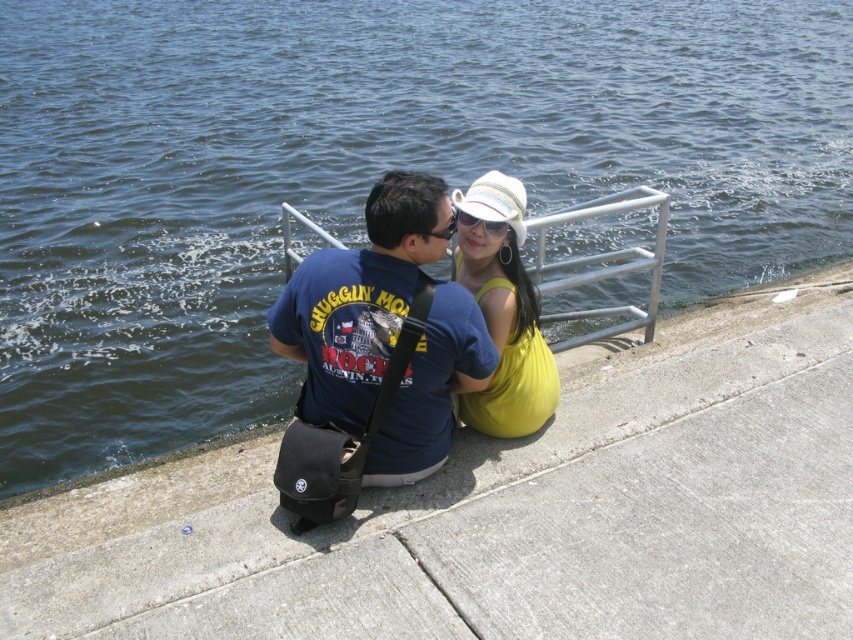
Does blue cotton t-shirt at center appear over yellow fabric dress at center?

No, blue cotton t-shirt at center is not above yellow fabric dress at center.

Is point (369, 346) closer to camera compared to point (523, 385)?

Yes, it is.

Locate an element on the screen. The height and width of the screenshot is (640, 853). blue cotton t-shirt at center is located at coordinates (360, 298).

Which is in front, point (642, 465) or point (488, 228)?

Point (488, 228) is in front.

Is concrete at lower center to the left of yellow fabric dress at center from the viewer's perspective?

In fact, concrete at lower center is to the right of yellow fabric dress at center.

Who is more distant from viewer, (668, 467) or (518, 220)?

The point (668, 467) is more distant.

Identify the location of concrete at lower center. (508, 512).

Can you confirm if blue cotton t-shirt at center is smaller than white woven baseball hat at center?

Incorrect, blue cotton t-shirt at center is not smaller in size than white woven baseball hat at center.

What do you see at coordinates (360, 298) in the screenshot? The image size is (853, 640). I see `blue cotton t-shirt at center` at bounding box center [360, 298].

You are a GUI agent. You are given a task and a screenshot of the screen. Output one action in this format:
    pyautogui.click(x=<x>, y=<y>)
    Task: Click on the blue cotton t-shirt at center
    The image size is (853, 640).
    Given the screenshot: What is the action you would take?
    pyautogui.click(x=360, y=298)